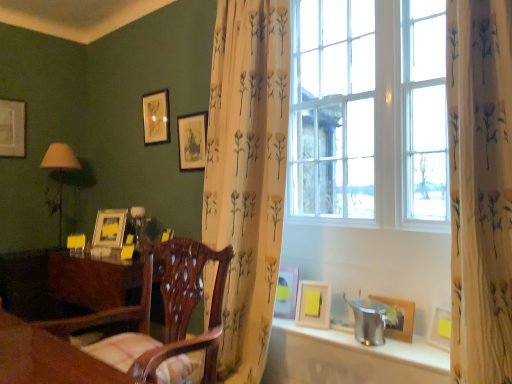
Question: From the image's perspective, would you say matte white picture frame at upper right, acting as the second picture frame starting from the front, is shown under gold metallic picture frame at left, which is the second picture frame from back to front?

Choices:
 (A) no
 (B) yes

Answer: (B)

Question: Is matte white picture frame at upper right, which is the sixth picture frame in back-to-front order, not close to gold metallic picture frame at left, the sixth picture frame when ordered from right to left?

Choices:
 (A) no
 (B) yes

Answer: (B)

Question: Can gold metallic picture frame at left, arranged as the 6th picture frame when viewed from the front, be found inside matte white picture frame at upper right, arranged as the second picture frame when viewed from the right?

Choices:
 (A) no
 (B) yes

Answer: (A)

Question: From a real-world perspective, is matte white picture frame at upper right, acting as the second picture frame starting from the front, located higher than gold metallic picture frame at left, which is the second picture frame from back to front?

Choices:
 (A) no
 (B) yes

Answer: (A)

Question: Is matte white picture frame at upper right, the 6th picture frame when ordered from left to right, to the left of gold metallic picture frame at left, which is the second picture frame from back to front, from the viewer's perspective?

Choices:
 (A) no
 (B) yes

Answer: (A)

Question: From the image's perspective, is matte beige lamp at left above or below gold metallic picture frame at left, arranged as the 6th picture frame when viewed from the front?

Choices:
 (A) above
 (B) below

Answer: (A)

Question: Considering the positions of matte beige lamp at left and gold metallic picture frame at left, the sixth picture frame when ordered from right to left, in the image, is matte beige lamp at left taller or shorter than gold metallic picture frame at left, the sixth picture frame when ordered from right to left,?

Choices:
 (A) short
 (B) tall

Answer: (B)

Question: Considering the positions of matte beige lamp at left and gold metallic picture frame at left, arranged as the 6th picture frame when viewed from the front, in the image, is matte beige lamp at left bigger or smaller than gold metallic picture frame at left, arranged as the 6th picture frame when viewed from the front,?

Choices:
 (A) big
 (B) small

Answer: (A)

Question: Does point (59, 238) appear closer or farther from the camera than point (104, 231)?

Choices:
 (A) closer
 (B) farther

Answer: (B)

Question: Is matte silver picture frame at upper left, marked as the 1th picture frame in a left-to-right arrangement, wider or thinner than matte wooden picture frame at upper center, the fourth picture frame in the right-to-left sequence?

Choices:
 (A) wide
 (B) thin

Answer: (B)

Question: From the image's perspective, is matte silver picture frame at upper left, the 7th picture frame from the right, positioned above or below matte wooden picture frame at upper center, the fourth picture frame positioned from the front?

Choices:
 (A) above
 (B) below

Answer: (A)

Question: Is matte silver picture frame at upper left, which is the 7th picture frame in front-to-back order, in front of or behind matte wooden picture frame at upper center, arranged as the 4th picture frame when viewed from the left, in the image?

Choices:
 (A) behind
 (B) front

Answer: (A)

Question: Based on their sizes in the image, would you say matte silver picture frame at upper left, marked as the first picture frame in a back-to-front arrangement, is bigger or smaller than matte wooden picture frame at upper center, the fourth picture frame in the right-to-left sequence?

Choices:
 (A) small
 (B) big

Answer: (A)

Question: Based on their positions, is wooden chair at center located to the left or right of matte wooden picture frame at upper center, the fourth picture frame positioned from the front?

Choices:
 (A) right
 (B) left

Answer: (A)

Question: In terms of width, does wooden chair at center look wider or thinner when compared to matte wooden picture frame at upper center, the fourth picture frame in the right-to-left sequence?

Choices:
 (A) thin
 (B) wide

Answer: (B)